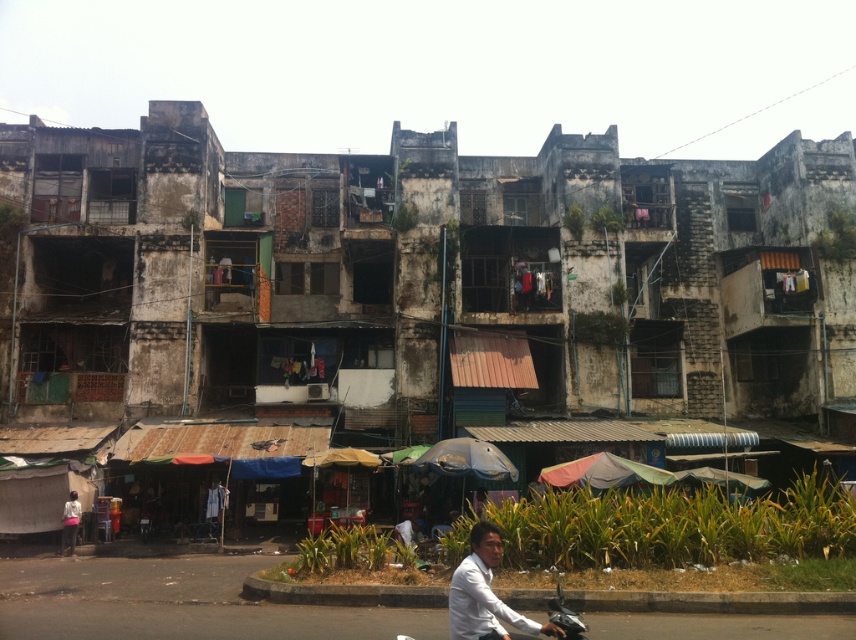
You are a delivery person trying to navigate through the market area. You see the metallic silver motorcycle at lower center and the white matte shirt at lower left. Which object is closer to you as you approach the scene?

The metallic silver motorcycle at lower center is closer to you since it is in front of the white matte shirt at lower left.

You are a customer at the market and want to buy a white matte shirt. You see the rusty metal hut at lower center and the white matte shirt at lower left. Which object is positioned higher in the image?

The rusty metal hut at lower center is located above the white matte shirt at lower left, so it is positioned higher in the image.